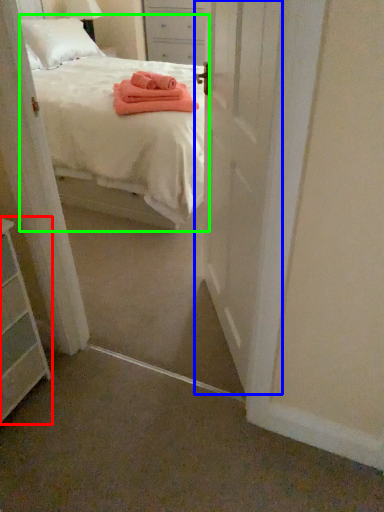
Question: Which object is positioned closest to chest of drawers (highlighted by a red box)? Select from door (highlighted by a blue box) and bed (highlighted by a green box).

Choices:
 (A) door
 (B) bed

Answer: (A)